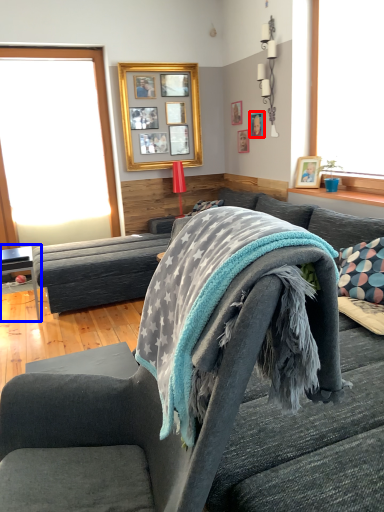
Question: Among these objects, which one is farthest to the camera, picture frame (highlighted by a red box) or table (highlighted by a blue box)?

Choices:
 (A) picture frame
 (B) table

Answer: (A)